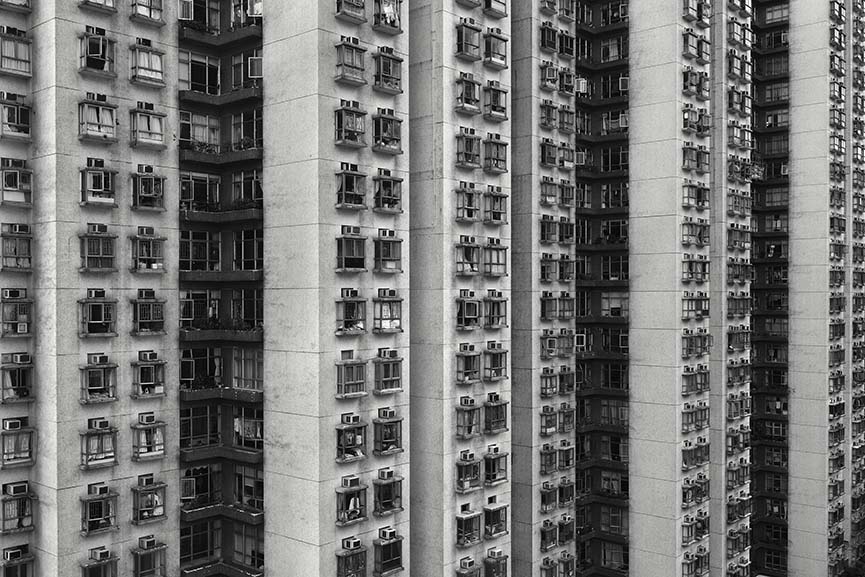
Identify the location of air conditioning unit located farthest bottom left in photo. The height and width of the screenshot is (577, 865). (15, 556).